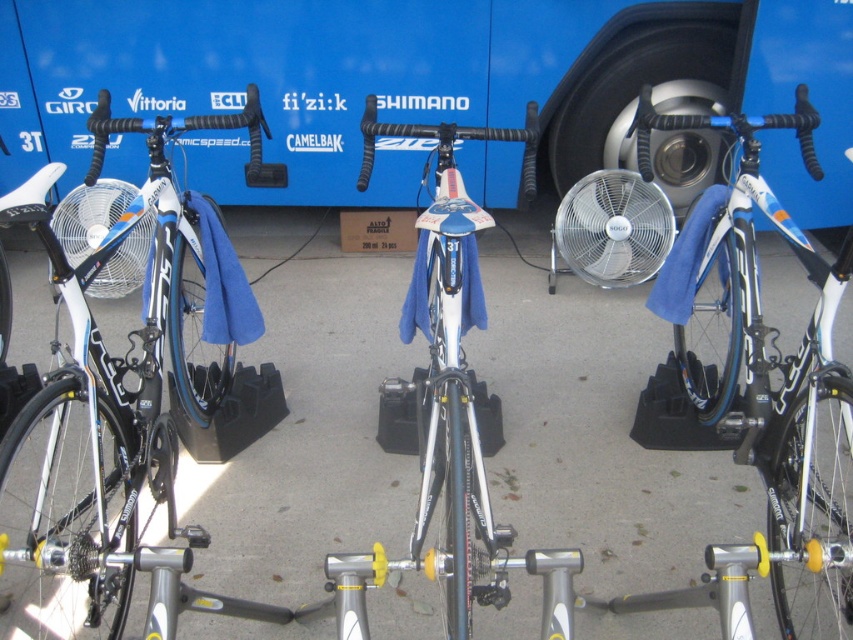
Question: Which point is farther to the camera?

Choices:
 (A) (99, 212)
 (B) (764, 212)
 (C) (28, 180)
 (D) (582, 260)

Answer: (D)

Question: Is the position of shiny blue frame at left less distant than that of shiny metallic bicycle at center?

Choices:
 (A) no
 (B) yes

Answer: (A)

Question: Does shiny metallic bicycle at center have a greater width compared to white plastic fan at left?

Choices:
 (A) no
 (B) yes

Answer: (A)

Question: Which object is closer to the camera taking this photo?

Choices:
 (A) shiny metallic bicycle at center
 (B) white plastic fan at left
 (C) shiny white bike at center
 (D) shiny blue frame at left

Answer: (A)

Question: Which of the following is the closest to the observer?

Choices:
 (A) (645, 156)
 (B) (450, 301)
 (C) (567, 253)
 (D) (100, 214)

Answer: (B)

Question: Can you confirm if shiny white bike at center is bigger than shiny metallic bicycle at center?

Choices:
 (A) no
 (B) yes

Answer: (B)